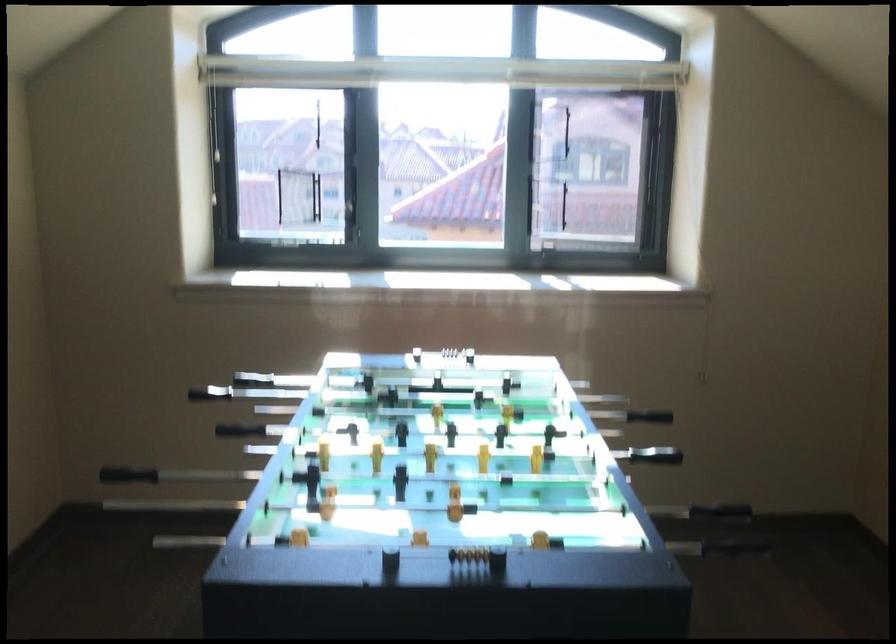
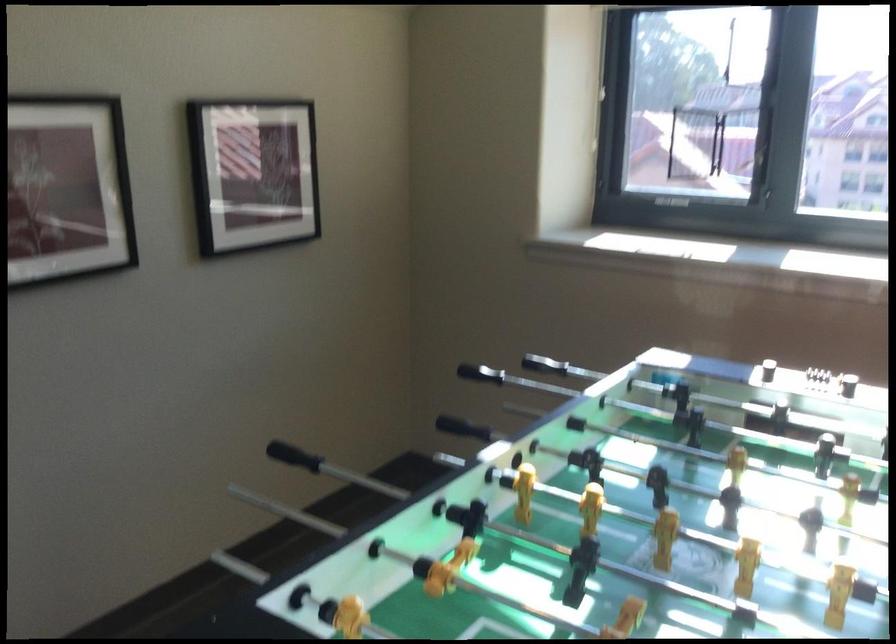
The point at (199, 386) is marked in the first image. Where is the corresponding point in the second image?

(544, 365)